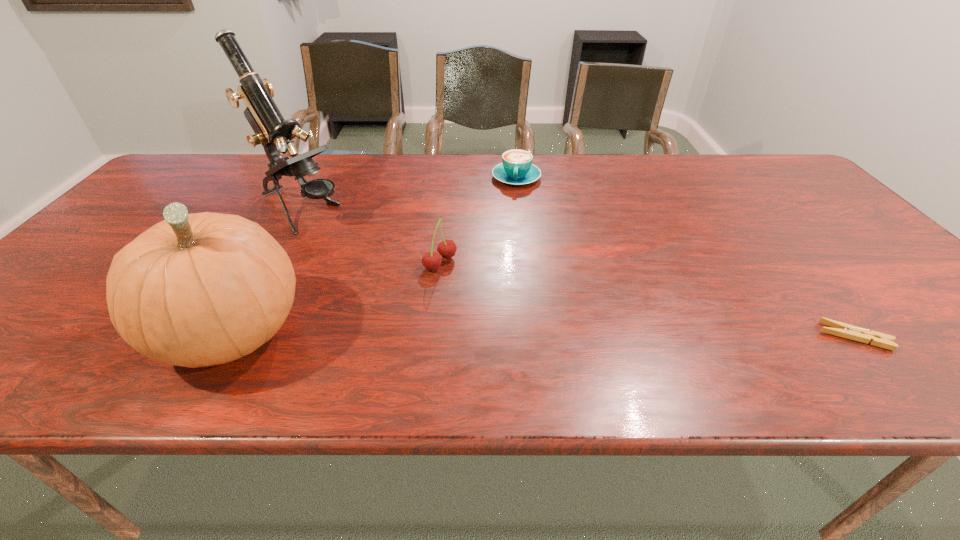
Find the location of a particular element. The height and width of the screenshot is (540, 960). empty location between the third object from left to right and the microscope is located at coordinates coord(371,237).

I want to click on free spot between the microscope and the clothespin, so click(x=578, y=273).

In order to click on empty location between the rightmost object and the third tallest object in this screenshot , I will do `click(647, 300)`.

Identify the location of free space between the clothespin and the pumpkin. (543, 335).

Find the location of a particular element. empty space that is in between the microscope and the second object from right to left is located at coordinates (409, 194).

Select which object appears as the second closest to the fourth shortest object. Please provide its 2D coordinates. Your answer should be formatted as a tuple, i.e. [(x, y)], where the tuple contains the x and y coordinates of a point satisfying the conditions above.

[(431, 261)]

Locate an element on the screen. The height and width of the screenshot is (540, 960). object that stands as the fourth closest to the rightmost object is located at coordinates (271, 130).

This screenshot has width=960, height=540. Identify the location of free space in the image that satisfies the following two spatial constraints: 1. on the back side of the second shortest object; 2. on the right side of the cherry. (449, 178).

You are a GUI agent. You are given a task and a screenshot of the screen. Output one action in this format:
    pyautogui.click(x=<x>, y=<y>)
    Task: Click on the blank space that satisfies the following two spatial constraints: 1. on the stem of the shortest object; 2. on the left side of the pumpkin
    This screenshot has height=540, width=960.
    Given the screenshot: What is the action you would take?
    pyautogui.click(x=229, y=336)